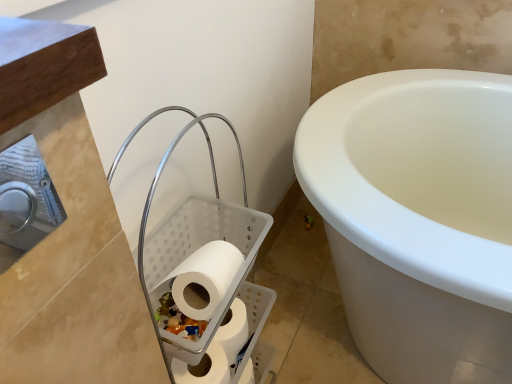
You are a GUI agent. You are given a task and a screenshot of the screen. Output one action in this format:
    pyautogui.click(x=<x>, y=<y>)
    Task: Click on the white matte toilet paper at lower center, arranged as the first toilet paper when ordered from the bottom
    
    Given the screenshot: What is the action you would take?
    pyautogui.click(x=203, y=367)

Locate an element on the screen. white plastic laundry basket at upper left is located at coordinates (205, 280).

Measure the distance between point (x=190, y=256) and camera.

→ A distance of 28.94 inches exists between point (x=190, y=256) and camera.

Describe the element at coordinates (218, 351) in the screenshot. This screenshot has height=384, width=512. I see `white matte toilet paper at lower center, the 2th toilet paper when ordered from bottom to top` at that location.

At what (x,y) coordinates should I click in order to perform the action: click on white matte toilet paper at lower center, the 2th toilet paper when ordered from bottom to top. Please return your answer as a coordinate pair (x, y). Image resolution: width=512 pixels, height=384 pixels. Looking at the image, I should click on (218, 351).

Find the location of a particular element. white matte toilet paper at lower center, which appears as the third toilet paper when viewed from the top is located at coordinates (203, 367).

Based on the photo, is white plastic laundry basket at upper left turned away from white matte toilet paper at center, placed as the third toilet paper when sorted from bottom to top?

Correct, white plastic laundry basket at upper left is looking away from white matte toilet paper at center, placed as the third toilet paper when sorted from bottom to top.

Does white plastic laundry basket at upper left have a lesser width compared to white matte toilet paper at center, which is the first toilet paper in top-to-bottom order?

Incorrect, the width of white plastic laundry basket at upper left is not less than that of white matte toilet paper at center, which is the first toilet paper in top-to-bottom order.

Who is smaller, white plastic laundry basket at upper left or white matte toilet paper at center, which is the first toilet paper in top-to-bottom order?

white matte toilet paper at center, which is the first toilet paper in top-to-bottom order, is smaller.

In the image, is white plastic laundry basket at upper left positioned in front of or behind white matte toilet paper at center, which is the first toilet paper in top-to-bottom order?

white plastic laundry basket at upper left is in front of white matte toilet paper at center, which is the first toilet paper in top-to-bottom order.

Can you see white matte toilet paper at lower center, arranged as the first toilet paper when ordered from the bottom, touching white plastic laundry basket at upper left?

No, white matte toilet paper at lower center, arranged as the first toilet paper when ordered from the bottom, is not beside white plastic laundry basket at upper left.

Based on the photo, is white matte toilet paper at lower center, which appears as the third toilet paper when viewed from the top, taller than white plastic laundry basket at upper left?

No.

Is point (224, 382) positioned before point (247, 215)?

Yes.

What's the angular difference between white plastic laundry basket at upper left and white matte toilet paper at lower center, arranged as the first toilet paper when ordered from the bottom,'s facing directions?

0.00375 degrees.

Considering the sizes of white plastic laundry basket at upper left and white matte toilet paper at lower center, arranged as the first toilet paper when ordered from the bottom, in the image, is white plastic laundry basket at upper left taller or shorter than white matte toilet paper at lower center, arranged as the first toilet paper when ordered from the bottom,?

Clearly, white plastic laundry basket at upper left is taller compared to white matte toilet paper at lower center, arranged as the first toilet paper when ordered from the bottom.

Which is closer to the camera, (256, 287) or (185, 370)?

Point (256, 287) appears to be farther away from the viewer than point (185, 370).

Considering the sizes of objects white plastic laundry basket at upper left and white matte toilet paper at lower center, which appears as the third toilet paper when viewed from the top, in the image provided, who is wider, white plastic laundry basket at upper left or white matte toilet paper at lower center, which appears as the third toilet paper when viewed from the top,?

Wider between the two is white plastic laundry basket at upper left.

Is white matte toilet paper at lower center, arranged as the 2th toilet paper when viewed from the top, directly adjacent to white matte toilet paper at lower center, which appears as the third toilet paper when viewed from the top?

Yes, white matte toilet paper at lower center, arranged as the 2th toilet paper when viewed from the top, is beside white matte toilet paper at lower center, which appears as the third toilet paper when viewed from the top.

Looking at their sizes, would you say white matte toilet paper at lower center, arranged as the 2th toilet paper when viewed from the top, is wider or thinner than white matte toilet paper at lower center, which appears as the third toilet paper when viewed from the top?

Considering their sizes, white matte toilet paper at lower center, arranged as the 2th toilet paper when viewed from the top, looks broader than white matte toilet paper at lower center, which appears as the third toilet paper when viewed from the top.

Which is behind, point (249, 338) or point (227, 365)?

The point (249, 338) is farther.

From the image's perspective, which is below, white matte toilet paper at lower center, arranged as the 2th toilet paper when viewed from the top, or white matte toilet paper at lower center, which appears as the third toilet paper when viewed from the top?

white matte toilet paper at lower center, which appears as the third toilet paper when viewed from the top, is shown below in the image.

Which is more to the left, white matte toilet paper at center, placed as the third toilet paper when sorted from bottom to top, or white matte toilet paper at lower center, the 2th toilet paper when ordered from bottom to top?

From the viewer's perspective, white matte toilet paper at lower center, the 2th toilet paper when ordered from bottom to top, appears more on the left side.

Is there a large distance between white matte toilet paper at center, placed as the third toilet paper when sorted from bottom to top, and white matte toilet paper at lower center, the 2th toilet paper when ordered from bottom to top?

Actually, white matte toilet paper at center, placed as the third toilet paper when sorted from bottom to top, and white matte toilet paper at lower center, the 2th toilet paper when ordered from bottom to top, are a little close together.

From a real-world perspective, is white matte toilet paper at center, placed as the third toilet paper when sorted from bottom to top, under white matte toilet paper at lower center, the 2th toilet paper when ordered from bottom to top?

No, from a real-world perspective, white matte toilet paper at center, placed as the third toilet paper when sorted from bottom to top, is not below white matte toilet paper at lower center, the 2th toilet paper when ordered from bottom to top.

Based on the photo, is white matte toilet paper at lower center, which appears as the third toilet paper when viewed from the top, at the left side of white matte toilet paper at center, which is the first toilet paper in top-to-bottom order?

Yes, white matte toilet paper at lower center, which appears as the third toilet paper when viewed from the top, is to the left of white matte toilet paper at center, which is the first toilet paper in top-to-bottom order.

Is white matte toilet paper at lower center, arranged as the first toilet paper when ordered from the bottom, positioned with its back to white matte toilet paper at center, which is the first toilet paper in top-to-bottom order?

white matte toilet paper at lower center, arranged as the first toilet paper when ordered from the bottom, is not turned away from white matte toilet paper at center, which is the first toilet paper in top-to-bottom order.

Which is closer to the camera, [224,353] or [180,285]?

The point [180,285] is closer to the camera.

Would you say white matte toilet paper at lower center, arranged as the first toilet paper when ordered from the bottom, is a long distance from white matte toilet paper at center, which is the first toilet paper in top-to-bottom order?

They are positioned close to each other.

Considering the relative sizes of white plastic laundry basket at upper left and white matte toilet paper at lower center, the 2th toilet paper when ordered from bottom to top, in the image provided, is white plastic laundry basket at upper left taller than white matte toilet paper at lower center, the 2th toilet paper when ordered from bottom to top,?

Correct, white plastic laundry basket at upper left is much taller as white matte toilet paper at lower center, the 2th toilet paper when ordered from bottom to top.

Between white plastic laundry basket at upper left and white matte toilet paper at lower center, the 2th toilet paper when ordered from bottom to top, which one appears on the left side from the viewer's perspective?

white plastic laundry basket at upper left.

Would you say white plastic laundry basket at upper left is inside or outside white matte toilet paper at lower center, the 2th toilet paper when ordered from bottom to top?

white plastic laundry basket at upper left is spatially situated outside white matte toilet paper at lower center, the 2th toilet paper when ordered from bottom to top.

Which toilet paper is the 2nd one when counting from the right side of the white plastic laundry basket at upper left? Please provide its 2D coordinates.

[(206, 275)]

This screenshot has width=512, height=384. I want to click on the 2nd toilet paper behind the white plastic laundry basket at upper left, starting your count from the anchor, so click(203, 367).

Looking at the image, which one is located closer to white plastic laundry basket at upper left, white matte toilet paper at lower center, arranged as the first toilet paper when ordered from the bottom, or white matte toilet paper at lower center, the 2th toilet paper when ordered from bottom to top?

The object closer to white plastic laundry basket at upper left is white matte toilet paper at lower center, the 2th toilet paper when ordered from bottom to top.

Based on their spatial positions, is white plastic laundry basket at upper left or white matte toilet paper at center, placed as the third toilet paper when sorted from bottom to top, further from white matte toilet paper at lower center, arranged as the 2th toilet paper when viewed from the top?

white matte toilet paper at center, placed as the third toilet paper when sorted from bottom to top, lies further to white matte toilet paper at lower center, arranged as the 2th toilet paper when viewed from the top, than the other object.

Looking at the image, which one is located closer to white plastic laundry basket at upper left, white matte toilet paper at center, placed as the third toilet paper when sorted from bottom to top, or white matte toilet paper at lower center, arranged as the first toilet paper when ordered from the bottom?

white matte toilet paper at center, placed as the third toilet paper when sorted from bottom to top, is closer to white plastic laundry basket at upper left.

Considering their positions, is white matte toilet paper at center, placed as the third toilet paper when sorted from bottom to top, positioned further to white matte toilet paper at lower center, which appears as the third toilet paper when viewed from the top, than white plastic laundry basket at upper left?

white plastic laundry basket at upper left.

Estimate the real-world distances between objects in this image. Which object is closer to white matte toilet paper at lower center, arranged as the 2th toilet paper when viewed from the top, white matte toilet paper at lower center, which appears as the third toilet paper when viewed from the top, or white matte toilet paper at center, which is the first toilet paper in top-to-bottom order?

Among the two, white matte toilet paper at lower center, which appears as the third toilet paper when viewed from the top, is located nearer to white matte toilet paper at lower center, arranged as the 2th toilet paper when viewed from the top.

Based on their spatial positions, is white plastic laundry basket at upper left or white matte toilet paper at lower center, which appears as the third toilet paper when viewed from the top, closer to white matte toilet paper at center, placed as the third toilet paper when sorted from bottom to top?

white plastic laundry basket at upper left.

Estimate the real-world distances between objects in this image. Which object is further from white plastic laundry basket at upper left, white matte toilet paper at center, placed as the third toilet paper when sorted from bottom to top, or white matte toilet paper at lower center, arranged as the 2th toilet paper when viewed from the top?

white matte toilet paper at lower center, arranged as the 2th toilet paper when viewed from the top, is further to white plastic laundry basket at upper left.

Considering their positions, is white matte toilet paper at center, placed as the third toilet paper when sorted from bottom to top, positioned further to white matte toilet paper at lower center, arranged as the 2th toilet paper when viewed from the top, than white plastic laundry basket at upper left?

white matte toilet paper at center, placed as the third toilet paper when sorted from bottom to top, is further to white matte toilet paper at lower center, arranged as the 2th toilet paper when viewed from the top.

Where is `toilet paper positioned between white plastic laundry basket at upper left and white matte toilet paper at lower center, arranged as the first toilet paper when ordered from the bottom, from near to far`? toilet paper positioned between white plastic laundry basket at upper left and white matte toilet paper at lower center, arranged as the first toilet paper when ordered from the bottom, from near to far is located at coordinates (206, 275).

Where is `toilet paper between white matte toilet paper at center, placed as the third toilet paper when sorted from bottom to top, and white matte toilet paper at lower center, which appears as the third toilet paper when viewed from the top, in the vertical direction`? This screenshot has height=384, width=512. toilet paper between white matte toilet paper at center, placed as the third toilet paper when sorted from bottom to top, and white matte toilet paper at lower center, which appears as the third toilet paper when viewed from the top, in the vertical direction is located at coordinates (218, 351).